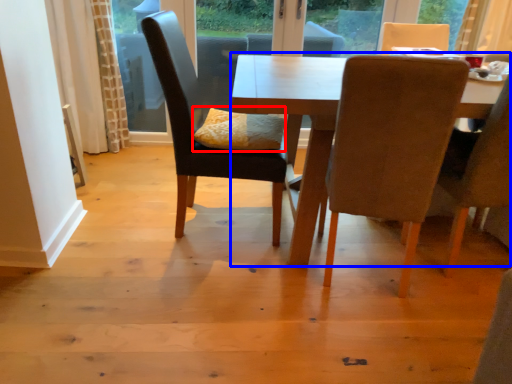
Question: Which of the following is the farthest to the observer, pillow (highlighted by a red box) or kitchen & dining room table (highlighted by a blue box)?

Choices:
 (A) pillow
 (B) kitchen & dining room table

Answer: (A)